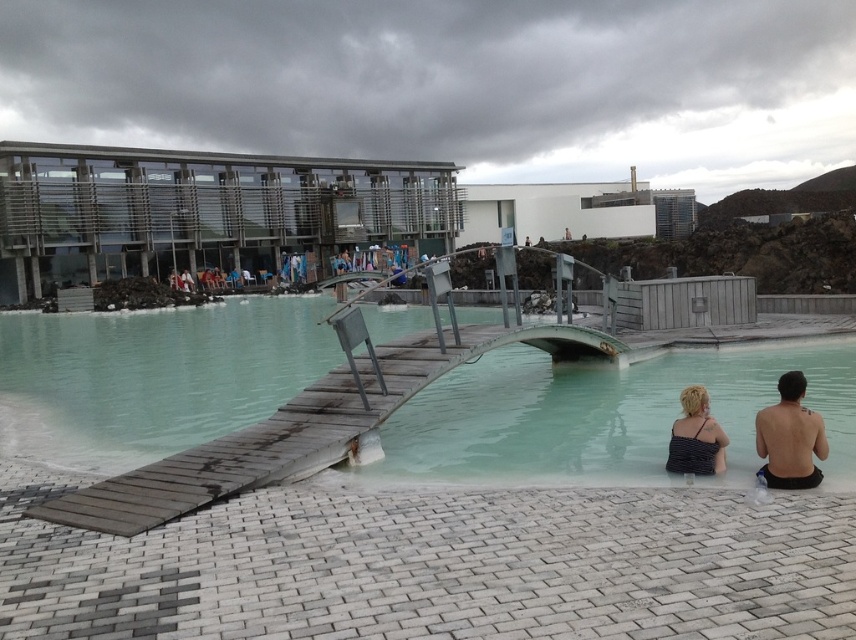
Question: Is clear turquoise water at center positioned before shiny skin at lower right?

Choices:
 (A) yes
 (B) no

Answer: (B)

Question: Is translucent wooden bridge at center bigger than striped fabric swimsuit at lower right?

Choices:
 (A) no
 (B) yes

Answer: (B)

Question: Which point is closer to the camera?

Choices:
 (A) (805, 460)
 (B) (720, 433)
 (C) (98, 317)

Answer: (A)

Question: Which object appears farthest from the camera in this image?

Choices:
 (A) translucent wooden bridge at center
 (B) shiny skin at lower right
 (C) striped fabric swimsuit at lower right

Answer: (A)

Question: Is translucent wooden bridge at center below clear turquoise water at center?

Choices:
 (A) yes
 (B) no

Answer: (B)

Question: Which of these objects is positioned farthest from the striped fabric swimsuit at lower right?

Choices:
 (A) shiny skin at lower right
 (B) translucent wooden bridge at center

Answer: (B)